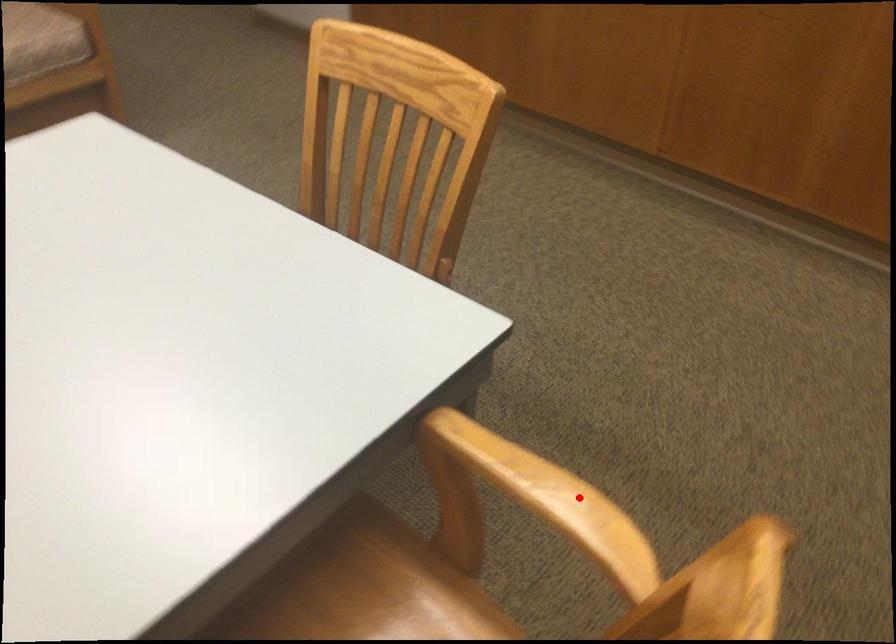
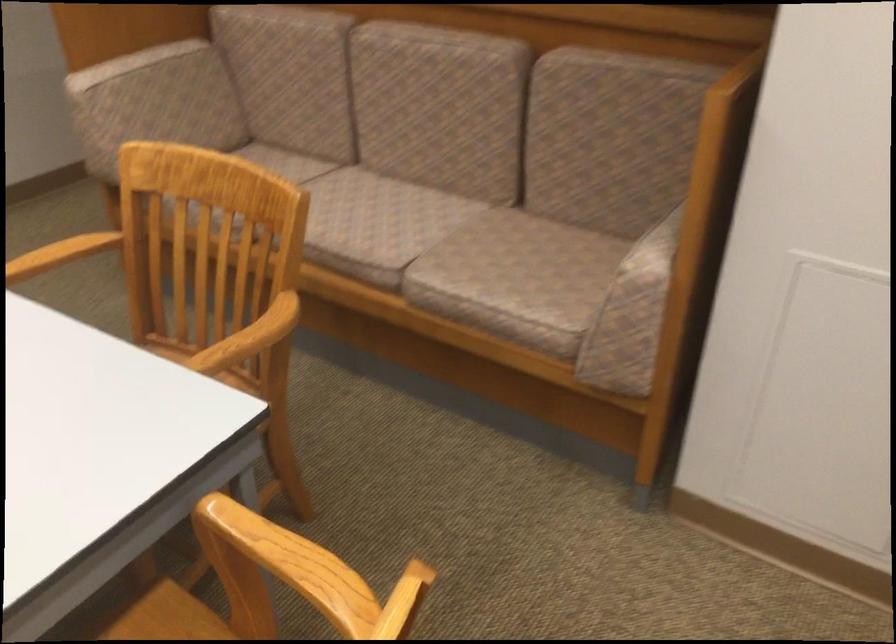
Question: I am providing you with two images of the same scene from different viewpoints. Image1 has a red point marked. In image2, the corresponding 3D location appears at what relative position? Reply with the corresponding letter.

Choices:
 (A) Closer
 (B) Farther

Answer: (B)